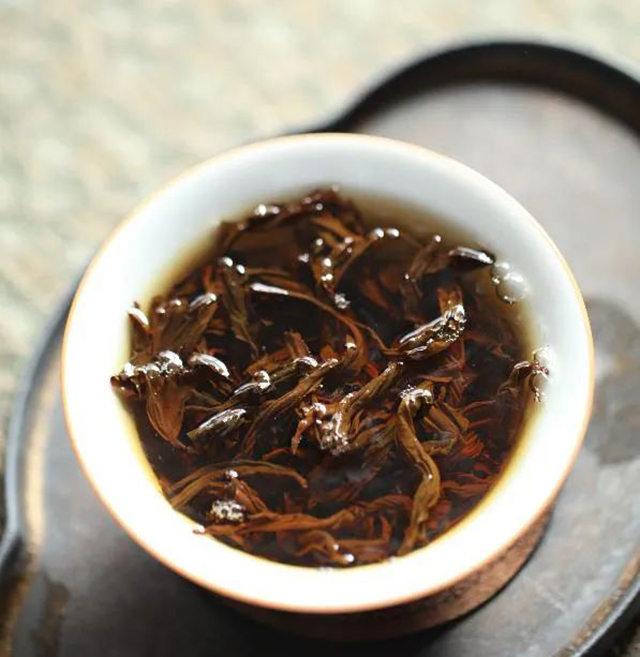
Find the location of a particular element. This screenshot has width=640, height=657. ceramic tea cup is located at coordinates (534, 422).